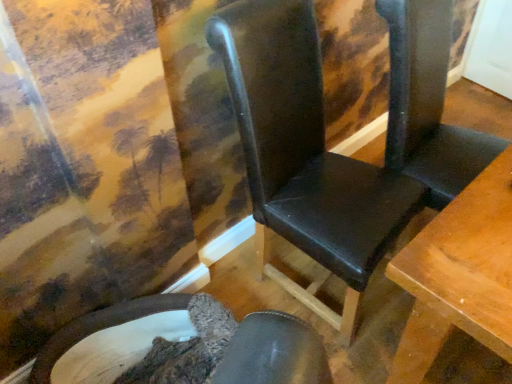
Question: Considering their positions, is black leather chair at center, which is the second chair from left to right, located in front of or behind velvet-like brown chair at lower left, placed as the 2th chair when sorted from right to left?

Choices:
 (A) behind
 (B) front

Answer: (B)

Question: Visually, is black leather chair at center, positioned as the first chair in right-to-left order, positioned to the left or to the right of velvet-like brown chair at lower left, placed as the 2th chair when sorted from right to left?

Choices:
 (A) right
 (B) left

Answer: (A)

Question: Which of these objects is positioned farthest from the velvet-like brown chair at lower left, placed as the 2th chair when sorted from right to left?

Choices:
 (A) black leather folding chair at center
 (B) black leather chair at center, positioned as the first chair in right-to-left order

Answer: (A)

Question: Which object is positioned closest to the black leather folding chair at center?

Choices:
 (A) velvet-like brown chair at lower left, the first chair when ordered from left to right
 (B) black leather chair at center, positioned as the first chair in right-to-left order

Answer: (B)